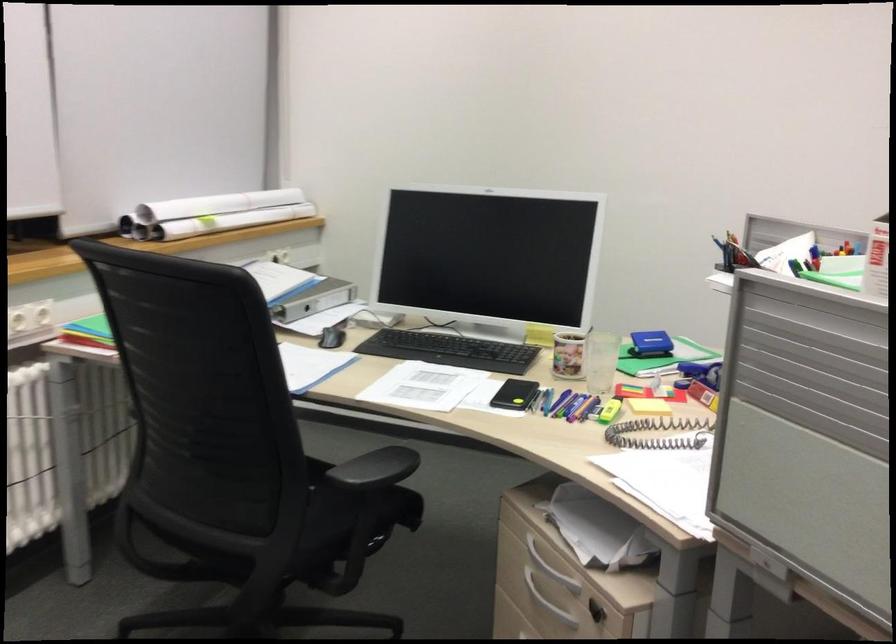
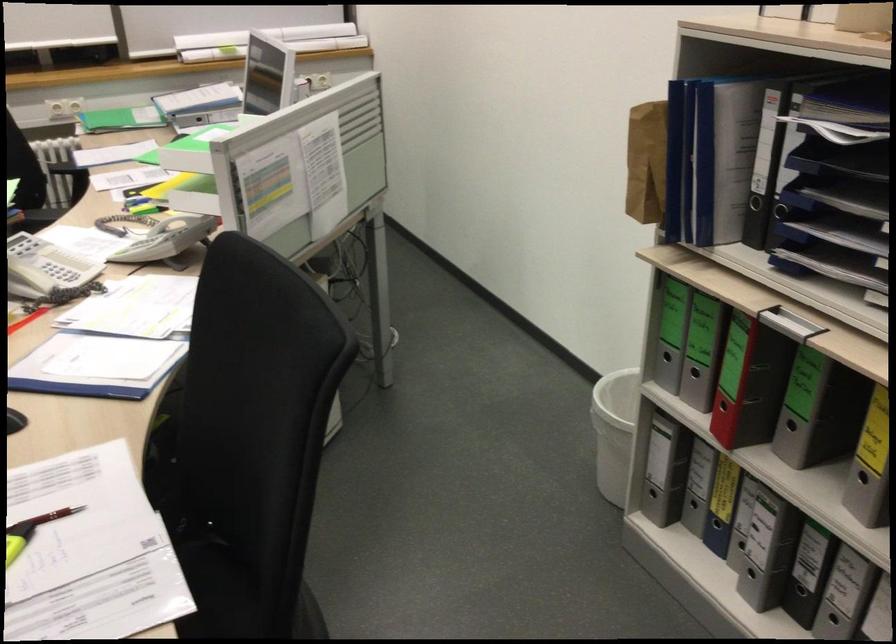
Question: I am providing you with two images of the same scene from different viewpoints. Which of the following objects are not visible in image2?

Choices:
 (A) white patterned mug
 (B) black paper tray
 (C) blue stapler
 (D) black binder finger hole

Answer: (C)